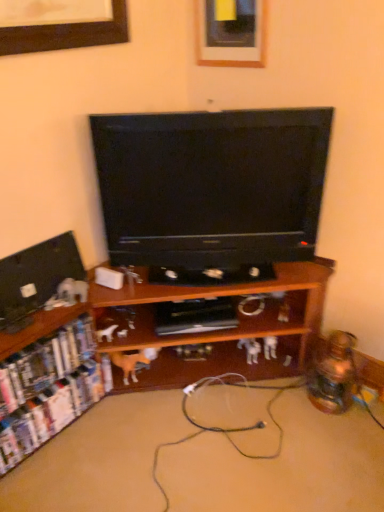
This screenshot has width=384, height=512. What are the coordinates of `empty space that is to the right of black rubber extension cord at lower center` in the screenshot? It's located at (223, 399).